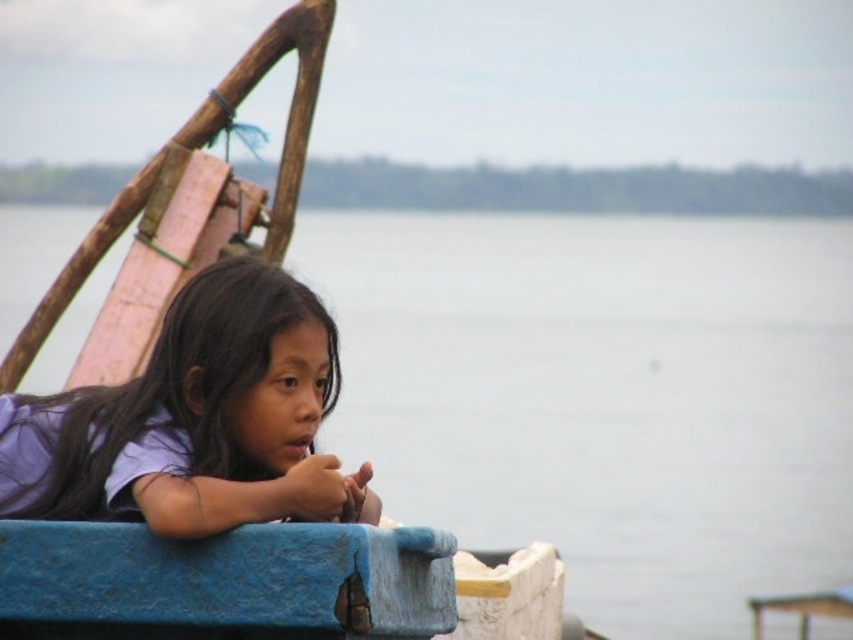
Question: Which point is farther from the camera taking this photo?

Choices:
 (A) (90, 436)
 (B) (689, 554)

Answer: (B)

Question: Which point is farther to the camera?

Choices:
 (A) (674, 604)
 (B) (192, 481)

Answer: (A)

Question: Does gray water at center appear on the right side of purple matte shirt at center?

Choices:
 (A) no
 (B) yes

Answer: (A)

Question: Is gray water at center above purple matte shirt at center?

Choices:
 (A) yes
 (B) no

Answer: (A)

Question: Can you confirm if gray water at center is positioned to the left of purple matte shirt at center?

Choices:
 (A) no
 (B) yes

Answer: (B)